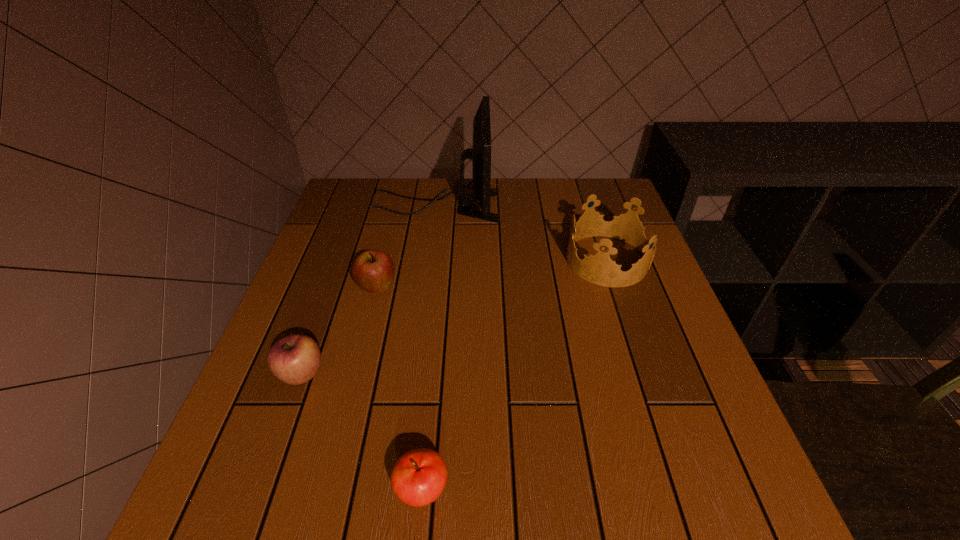
At what (x,y) coordinates should I click in order to perform the action: click on the tallest object. Please return your answer as a coordinate pair (x, y). This screenshot has height=540, width=960. Looking at the image, I should click on coord(480,153).

Identify the location of tiara. (599, 269).

Identify the location of the farthest apple. This screenshot has width=960, height=540. (373, 270).

This screenshot has height=540, width=960. I want to click on the leftmost apple, so click(295, 359).

Identify the location of the second nearest object. This screenshot has height=540, width=960. (295, 359).

The image size is (960, 540). Identify the location of the nearest object. (418, 478).

Image resolution: width=960 pixels, height=540 pixels. Identify the location of the rightmost apple. (418, 478).

In order to click on free region located on the screen side of the tallest object in this screenshot , I will do `click(535, 206)`.

Identify the location of free space located on the front-facing side of the tiara. The width and height of the screenshot is (960, 540). (440, 260).

Image resolution: width=960 pixels, height=540 pixels. Find the location of `vacant point located 0.100m on the front-facing side of the tiara`. vacant point located 0.100m on the front-facing side of the tiara is located at coordinates (527, 260).